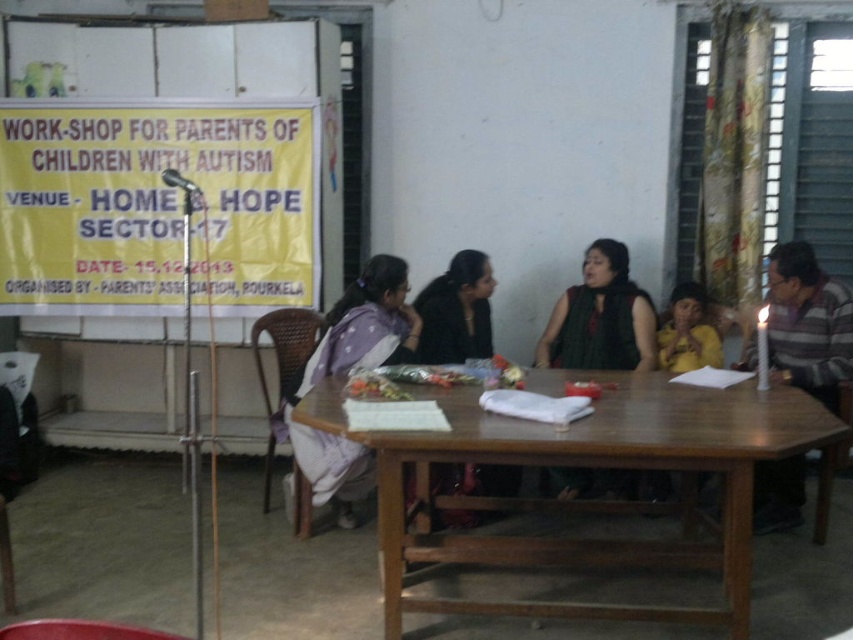
Question: Considering the real-world distances, which object is farthest from the black matte jacket at center?

Choices:
 (A) green matte scarf at center
 (B) purple fabric at center

Answer: (A)

Question: Which object is closer to the camera taking this photo?

Choices:
 (A) purple fabric at center
 (B) green matte scarf at center

Answer: (A)

Question: Is purple fabric at center bigger than black matte jacket at center?

Choices:
 (A) no
 (B) yes

Answer: (B)

Question: Is green matte scarf at center thinner than black matte jacket at center?

Choices:
 (A) no
 (B) yes

Answer: (A)

Question: Which point is farther from the camera taking this photo?

Choices:
 (A) (474, 396)
 (B) (445, 314)
 (C) (572, 352)
 (D) (345, 476)

Answer: (C)

Question: Is the position of purple fabric at center less distant than that of green matte scarf at center?

Choices:
 (A) yes
 (B) no

Answer: (A)